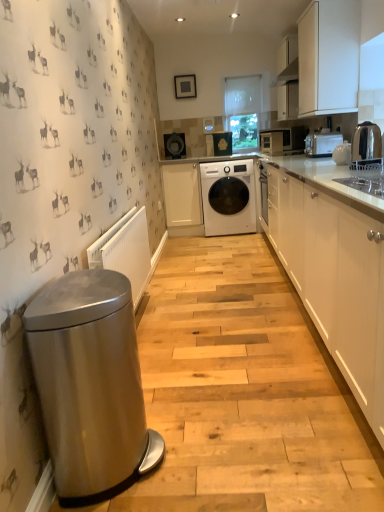
Question: Would you say metallic silver toaster at upper right, the second home appliance from the top, contains matte black microwave at upper right, placed as the second home appliance when sorted from front to back?

Choices:
 (A) yes
 (B) no

Answer: (B)

Question: Does metallic silver toaster at upper right, the second home appliance from the top, have a lesser width compared to matte black microwave at upper right, the second home appliance when ordered from bottom to top?

Choices:
 (A) no
 (B) yes

Answer: (B)

Question: Is metallic silver toaster at upper right, which appears as the first home appliance when viewed from the front, positioned far away from matte black microwave at upper right, the first home appliance viewed from the back?

Choices:
 (A) yes
 (B) no

Answer: (A)

Question: Considering the relative positions of metallic silver toaster at upper right, the second home appliance positioned from the back, and matte black microwave at upper right, placed as the second home appliance when sorted from front to back, in the image provided, is metallic silver toaster at upper right, the second home appliance positioned from the back, behind matte black microwave at upper right, placed as the second home appliance when sorted from front to back,?

Choices:
 (A) no
 (B) yes

Answer: (A)

Question: Is metallic silver toaster at upper right, which appears as the first home appliance when viewed from the front, oriented towards matte black microwave at upper right, placed as the second home appliance when sorted from front to back?

Choices:
 (A) no
 (B) yes

Answer: (A)

Question: Considering the positions of matte white microwave at center, placed as the second appliance when sorted from right to left, and white glossy washing machine at center in the image, is matte white microwave at center, placed as the second appliance when sorted from right to left, bigger or smaller than white glossy washing machine at center?

Choices:
 (A) big
 (B) small

Answer: (B)

Question: Which is correct: matte white microwave at center, arranged as the second appliance when viewed from the front, is inside white glossy washing machine at center, or outside of it?

Choices:
 (A) outside
 (B) inside

Answer: (A)

Question: From a real-world perspective, is matte white microwave at center, which is counted as the third appliance, starting from the back, above or below white glossy washing machine at center?

Choices:
 (A) below
 (B) above

Answer: (B)

Question: Visually, is matte white microwave at center, which is counted as the second appliance, starting from the bottom, positioned to the left or to the right of white glossy washing machine at center?

Choices:
 (A) left
 (B) right

Answer: (B)

Question: Is point (266, 144) closer or farther from the camera than point (114, 404)?

Choices:
 (A) closer
 (B) farther

Answer: (B)

Question: From a real-world perspective, is matte white microwave at center, which is the 3th appliance from left to right, positioned above or below stainless steel trash can at left?

Choices:
 (A) below
 (B) above

Answer: (B)

Question: Is matte white microwave at center, which is counted as the second appliance, starting from the bottom, spatially inside stainless steel trash can at left, or outside of it?

Choices:
 (A) inside
 (B) outside

Answer: (B)

Question: Relative to stainless steel trash can at left, is matte white microwave at center, which is counted as the second appliance, starting from the bottom, in front or behind?

Choices:
 (A) behind
 (B) front

Answer: (A)

Question: From their relative heights in the image, would you say matte black washing machine at center, which appears as the third appliance when viewed from the front, is taller or shorter than matte black microwave at upper right, the second home appliance when ordered from bottom to top?

Choices:
 (A) short
 (B) tall

Answer: (B)

Question: In the image, is matte black washing machine at center, positioned as the first appliance in left-to-right order, positioned in front of or behind matte black microwave at upper right, the 1th home appliance positioned from the top?

Choices:
 (A) front
 (B) behind

Answer: (B)